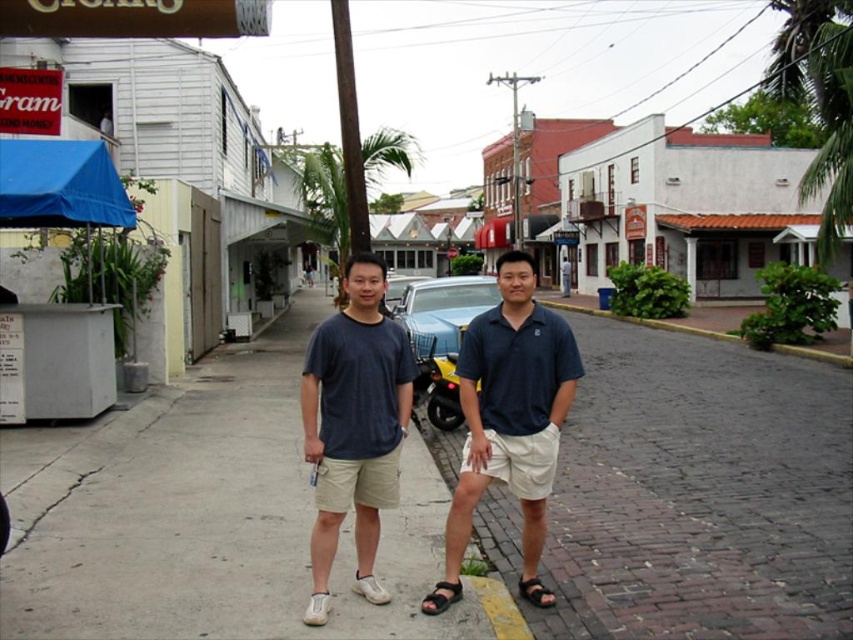
Question: Does dark blue polo shirt at center lie behind matte blue t-shirt at center?

Choices:
 (A) no
 (B) yes

Answer: (A)

Question: Among these objects, which one is farthest from the camera?

Choices:
 (A) gray concrete sidewalk at center
 (B) blue metallic car at center

Answer: (B)

Question: Is dark blue polo shirt at center thinner than blue metallic car at center?

Choices:
 (A) no
 (B) yes

Answer: (B)

Question: Among these objects, which one is farthest from the camera?

Choices:
 (A) blue metallic car at center
 (B) dark blue polo shirt at center
 (C) matte blue t-shirt at center
 (D) gray concrete sidewalk at center

Answer: (A)

Question: Which of the following is the closest to the observer?

Choices:
 (A) coord(488,634)
 (B) coord(352,323)
 (C) coord(460,413)
 (D) coord(511,448)

Answer: (A)

Question: Does gray concrete sidewalk at center have a larger size compared to blue metallic car at center?

Choices:
 (A) yes
 (B) no

Answer: (B)